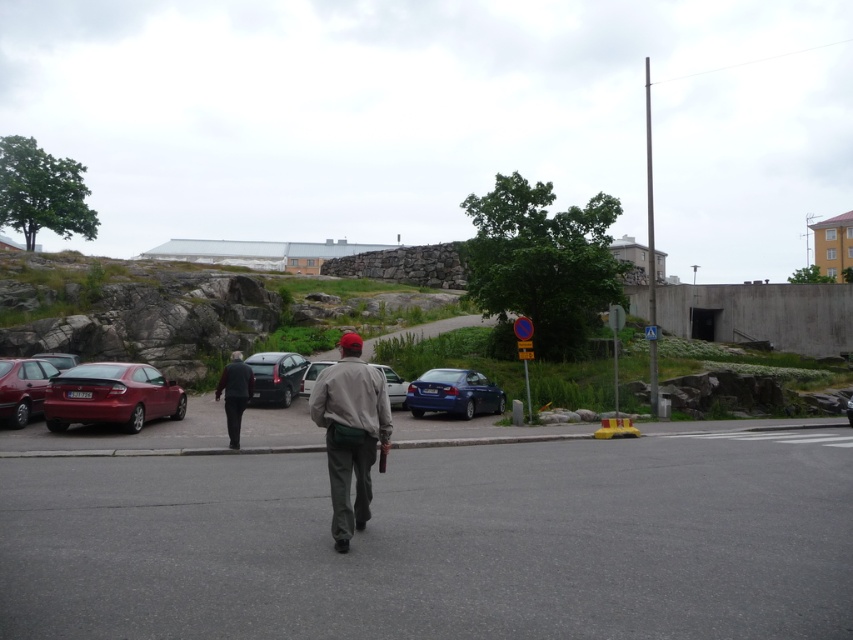
You are a photographer trying to capture a clear shot of the gray fabric jacket at center and the metallic blue sedan at center. Since the jacket is thinner than the sedan, which object might require a closer focus to ensure sharpness?

The gray fabric jacket at center is thinner than the metallic blue sedan at center, so the jacket might require closer focus to ensure sharpness because it has less depth compared to the sedan.

You are standing at the center of the paved road in the image. Looking towards the left side, you see a point marked at coordinates (22,388). What object in the scene corresponds to this point?

The shiny red sedan at left is represented by point (22,388).